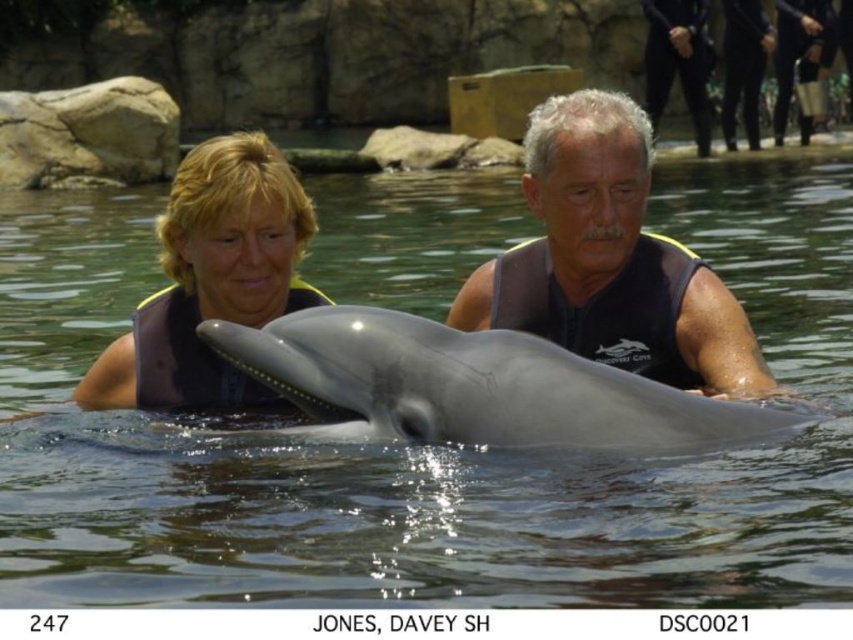
The width and height of the screenshot is (853, 640). What do you see at coordinates (212, 280) in the screenshot?
I see `matte black wetsuit at upper left` at bounding box center [212, 280].

Is matte black wetsuit at upper left smaller than black neoprene wetsuit at upper right?

Incorrect, matte black wetsuit at upper left is not smaller in size than black neoprene wetsuit at upper right.

Between point (170, 294) and point (689, 65), which one is positioned behind?

The point (689, 65) is more distant.

This screenshot has height=640, width=853. I want to click on matte black wetsuit at upper left, so click(x=212, y=280).

Does matte black wetsuit at center have a greater width compared to matte black wetsuit at upper left?

No, matte black wetsuit at center is not wider than matte black wetsuit at upper left.

Between point (529, 157) and point (268, 400), which one is positioned behind?

Positioned behind is point (268, 400).

Describe the element at coordinates (610, 260) in the screenshot. The height and width of the screenshot is (640, 853). I see `matte black wetsuit at center` at that location.

Locate an element on the screen. This screenshot has width=853, height=640. matte black wetsuit at center is located at coordinates (610, 260).

Between sleek gray dolphin at center and matte black wetsuit at upper left, which one appears on the left side from the viewer's perspective?

matte black wetsuit at upper left

Is point (584, 440) positioned before point (218, 209)?

That is True.

Does point (395, 410) lie behind point (209, 284)?

No, it is not.

Where is `sleek gray dolphin at center`? This screenshot has height=640, width=853. sleek gray dolphin at center is located at coordinates (474, 387).